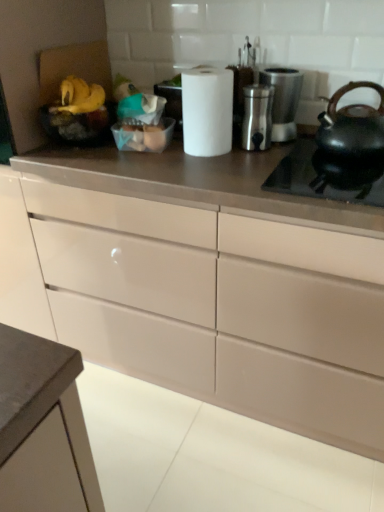
The image size is (384, 512). In order to click on vacant region to the right of satin silver container at center, which appears as the 2th appliance when viewed from the right in this screenshot , I will do `click(295, 150)`.